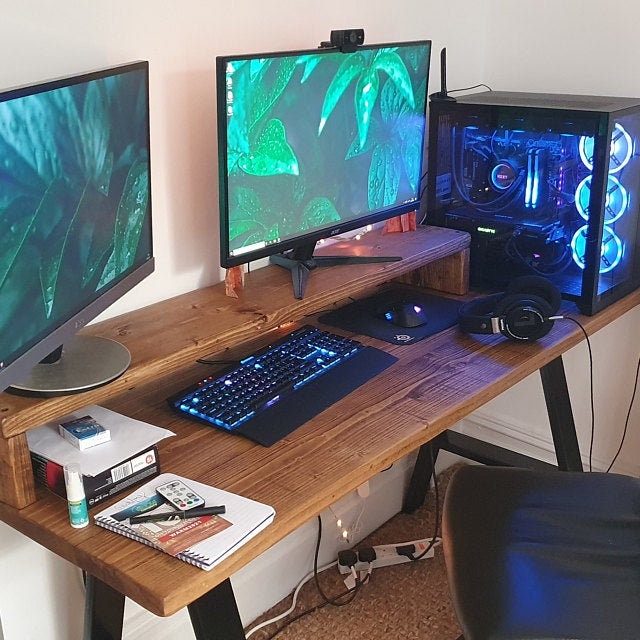
Identify the location of keyboard. The image size is (640, 640). (269, 386).